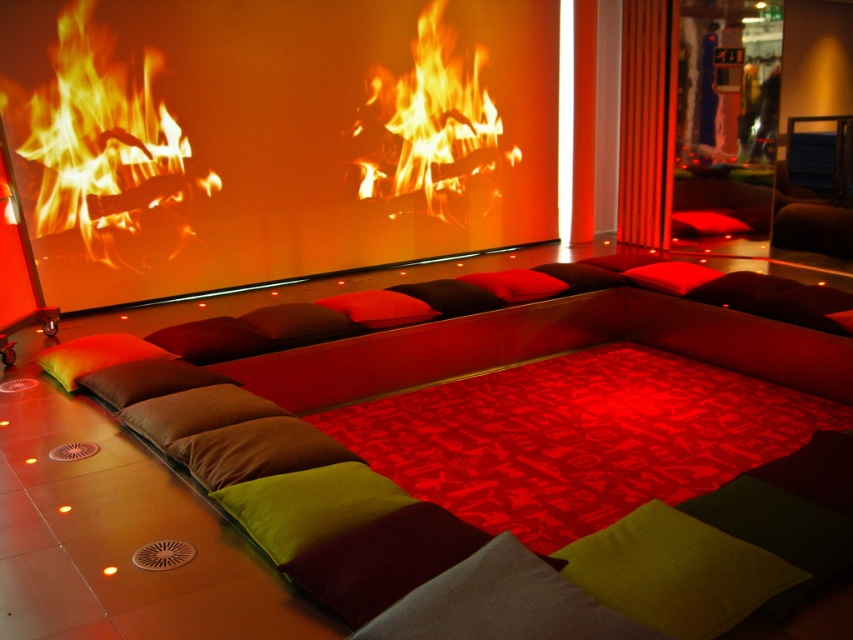
Does green fabric pillow at lower left appear on the right side of dark brown cushion at center?

No, green fabric pillow at lower left is not to the right of dark brown cushion at center.

Does green fabric pillow at lower left appear on the left side of dark brown cushion at center?

Indeed, green fabric pillow at lower left is positioned on the left side of dark brown cushion at center.

This screenshot has height=640, width=853. I want to click on green fabric pillow at lower left, so click(148, 380).

Is flamewooden logs at center behind green fabric pillow at lower left?

Yes, flamewooden logs at center is behind green fabric pillow at lower left.

Between point (474, 168) and point (114, 392), which one is positioned behind?

The point (474, 168) is more distant.

What are the coordinates of `flamewooden logs at center` in the screenshot? It's located at pos(433,122).

Is red velvet cushion at center to the right of velvet red pillow at center from the viewer's perspective?

Incorrect, red velvet cushion at center is not on the right side of velvet red pillow at center.

Who is shorter, red velvet cushion at center or velvet red pillow at center?

velvet red pillow at center is shorter.

Is point (502, 292) less distant than point (717, 228)?

Yes, point (502, 292) is closer to viewer.

Find the location of a particular element. Image resolution: width=853 pixels, height=640 pixels. red velvet cushion at center is located at coordinates (515, 284).